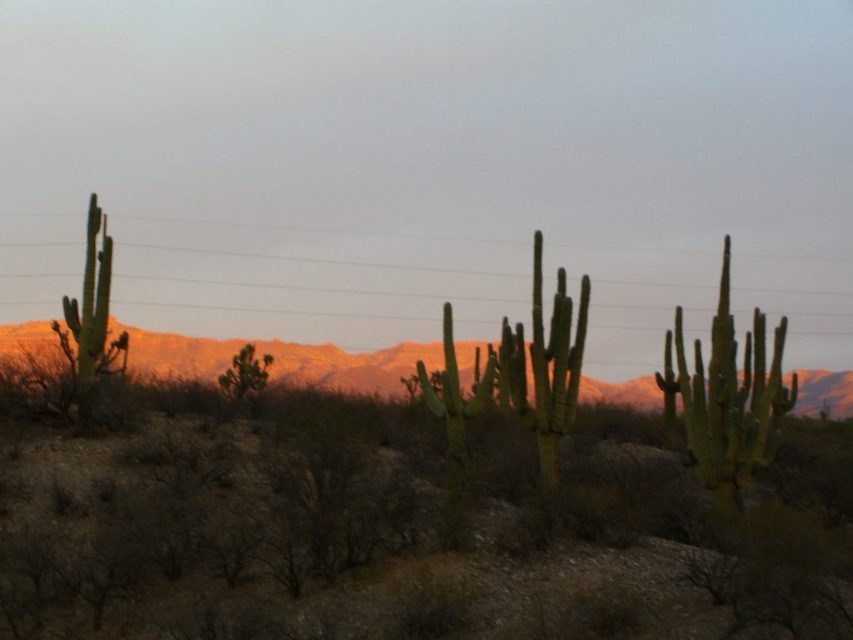
From the picture: Does rustic sandstone mountains at center have a lesser height compared to green spiny cactus at left?

Correct, rustic sandstone mountains at center is not as tall as green spiny cactus at left.

Is rustic sandstone mountains at center bigger than green spiny cactus at left?

Yes, rustic sandstone mountains at center is bigger than green spiny cactus at left.

Does point (839, 413) come farther from viewer compared to point (65, 321)?

Yes, it is.

The image size is (853, 640). I want to click on rustic sandstone mountains at center, so click(277, 360).

The image size is (853, 640). I want to click on rustic sandstone mountains at center, so click(277, 360).

Based on the photo, can you confirm if rustic sandstone mountains at center is taller than green spiny cactus at right?

No, rustic sandstone mountains at center is not taller than green spiny cactus at right.

Describe the element at coordinates (277, 360) in the screenshot. I see `rustic sandstone mountains at center` at that location.

You are a GUI agent. You are given a task and a screenshot of the screen. Output one action in this format:
    pyautogui.click(x=<x>, y=<y>)
    Task: Click on the rustic sandstone mountains at center
    This screenshot has height=640, width=853.
    Given the screenshot: What is the action you would take?
    pyautogui.click(x=277, y=360)

Which of these two, green spiny cactus at right or green spiny cactus at left, stands shorter?

green spiny cactus at right is shorter.

Does green spiny cactus at right have a lesser width compared to green spiny cactus at left?

Indeed, green spiny cactus at right has a lesser width compared to green spiny cactus at left.

Who is more forward, (746,448) or (86,225)?

Point (746,448) is more forward.

Locate an element on the screen. This screenshot has width=853, height=640. green spiny cactus at right is located at coordinates (726, 396).